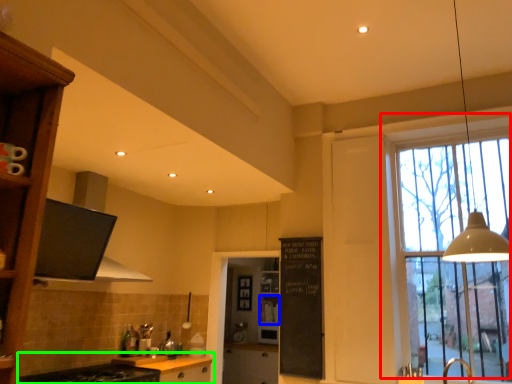
Question: Considering the real-world distances, which object is closest to window (highlighted by a red box)? shelf (highlighted by a blue box) or cabinetry (highlighted by a green box).

Choices:
 (A) shelf
 (B) cabinetry

Answer: (B)